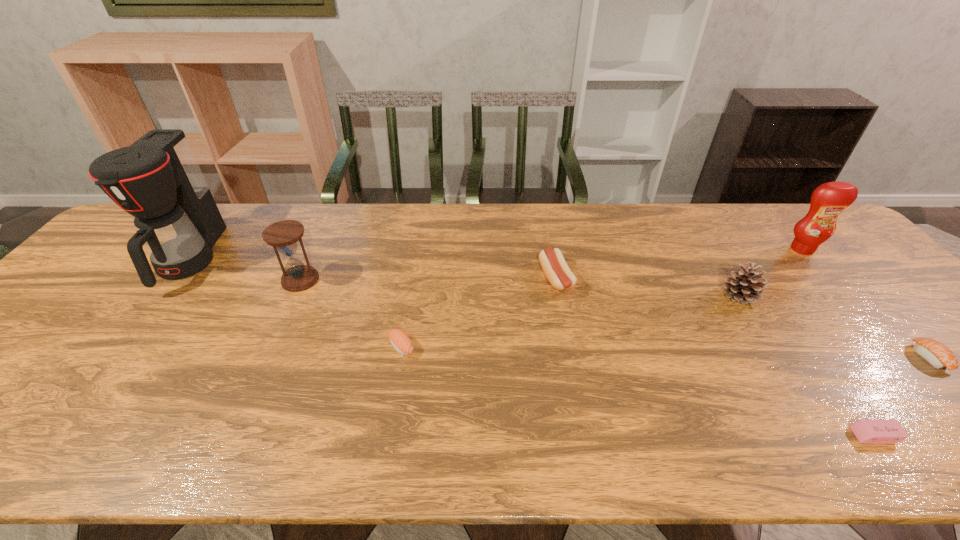
The width and height of the screenshot is (960, 540). In order to click on the sixth tallest object in this screenshot , I will do `click(400, 341)`.

Locate an element on the screen. the right sushi is located at coordinates (937, 354).

Image resolution: width=960 pixels, height=540 pixels. In order to click on the seventh tallest object in this screenshot , I will do `click(937, 354)`.

Image resolution: width=960 pixels, height=540 pixels. I want to click on eraser, so click(x=866, y=431).

Find the location of a particular element. Image resolution: width=960 pixels, height=540 pixels. the shortest object is located at coordinates (866, 431).

This screenshot has height=540, width=960. Find the location of `vacant position located 0.310m pour from the carafe of the leftmost object`. vacant position located 0.310m pour from the carafe of the leftmost object is located at coordinates (79, 402).

Identify the location of vacant space located 0.110m on the label side of the second tallest object. This screenshot has width=960, height=540. (830, 282).

The image size is (960, 540). What are the coordinates of `free space located on the right of the hourglass` in the screenshot? It's located at (365, 280).

Find the location of `vacant space located 0.160m on the left of the pinecone`. vacant space located 0.160m on the left of the pinecone is located at coordinates (661, 296).

This screenshot has width=960, height=540. Identify the location of vacant space located 0.330m on the left of the fourth shortest object. (421, 279).